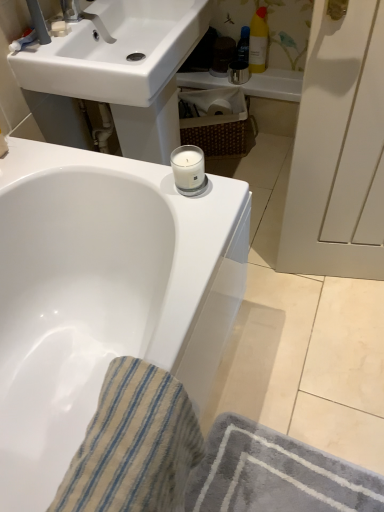
Question: Is matte white faucet at upper left smaller than white glossy bathtub at upper center?

Choices:
 (A) no
 (B) yes

Answer: (B)

Question: From the image's perspective, is matte white faucet at upper left over white glossy bathtub at upper center?

Choices:
 (A) yes
 (B) no

Answer: (A)

Question: From a real-world perspective, is matte white faucet at upper left located higher than white glossy bathtub at upper center?

Choices:
 (A) yes
 (B) no

Answer: (A)

Question: Is matte white faucet at upper left at the right side of white glossy bathtub at upper center?

Choices:
 (A) no
 (B) yes

Answer: (A)

Question: Is matte white faucet at upper left in contact with white glossy bathtub at upper center?

Choices:
 (A) no
 (B) yes

Answer: (A)

Question: Considering the positions of matte white faucet at upper left and white glossy bathtub at upper center in the image, is matte white faucet at upper left taller or shorter than white glossy bathtub at upper center?

Choices:
 (A) short
 (B) tall

Answer: (A)

Question: Is matte white faucet at upper left inside the boundaries of white glossy bathtub at upper center, or outside?

Choices:
 (A) inside
 (B) outside

Answer: (B)

Question: Looking at their shapes, would you say matte white faucet at upper left is wider or thinner than white glossy bathtub at upper center?

Choices:
 (A) wide
 (B) thin

Answer: (B)

Question: Is matte white faucet at upper left in front of or behind white glossy bathtub at upper center in the image?

Choices:
 (A) front
 (B) behind

Answer: (B)

Question: From the image's perspective, is yellow matte bottle at upper right, which ranks as the 2th toiletry in left-to-right order, above or below matte white faucet at upper left?

Choices:
 (A) above
 (B) below

Answer: (A)

Question: Looking at their shapes, would you say yellow matte bottle at upper right, which ranks as the 2th toiletry in left-to-right order, is wider or thinner than matte white faucet at upper left?

Choices:
 (A) thin
 (B) wide

Answer: (A)

Question: Based on their sizes in the image, would you say yellow matte bottle at upper right, which appears as the 1th toiletry when viewed from the right, is bigger or smaller than matte white faucet at upper left?

Choices:
 (A) small
 (B) big

Answer: (B)

Question: Relative to matte white faucet at upper left, is yellow matte bottle at upper right, which ranks as the 2th toiletry in left-to-right order, in front or behind?

Choices:
 (A) behind
 (B) front

Answer: (A)

Question: Would you say white glossy sink at upper center is to the left or to the right of matte white faucet at upper left in the picture?

Choices:
 (A) right
 (B) left

Answer: (A)

Question: Does point (135, 142) appear closer or farther from the camera than point (74, 14)?

Choices:
 (A) farther
 (B) closer

Answer: (A)